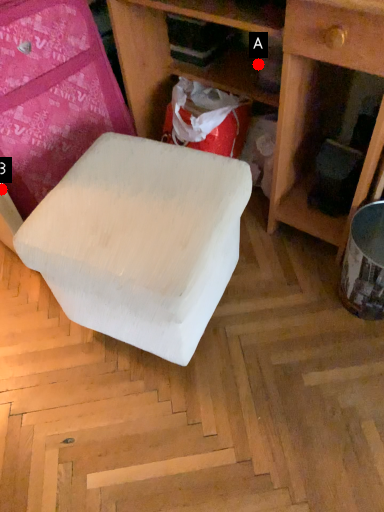
Question: Two points are circled on the image, labeled by A and B beside each circle. Which point is closer to the camera?

Choices:
 (A) A is closer
 (B) B is closer

Answer: (B)